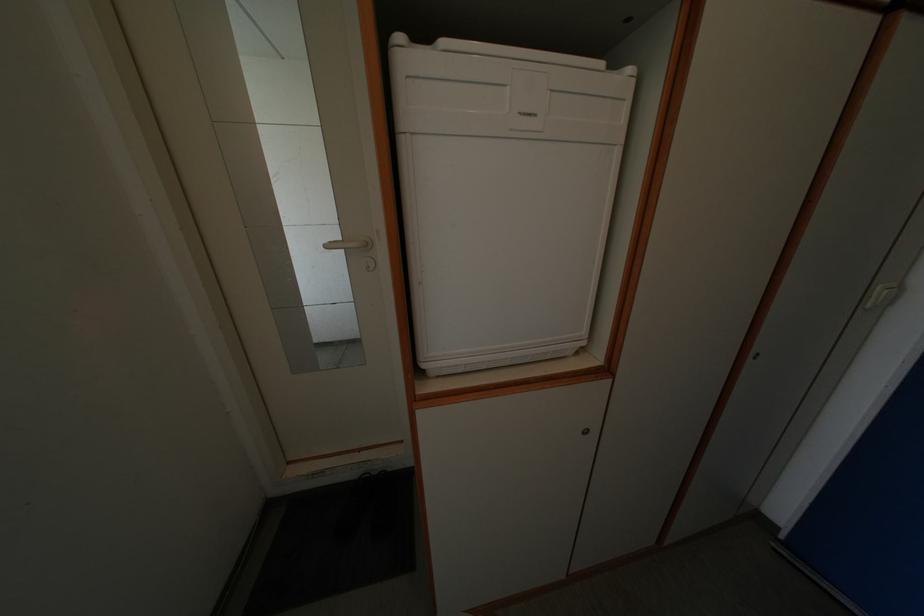
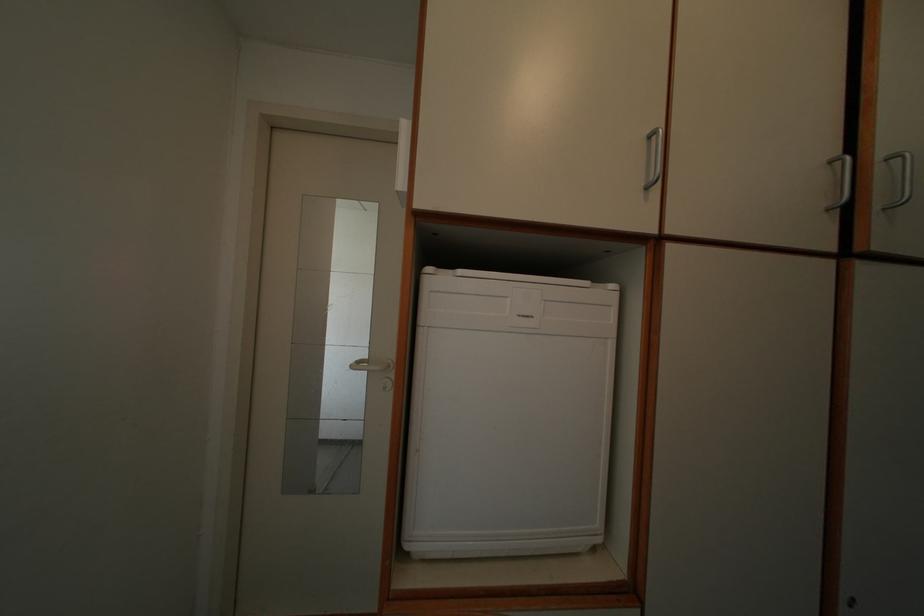
Question: The images are taken continuously from a first-person perspective. In which direction is your viewpoint rotating?

Choices:
 (A) Left
 (B) Right
 (C) Up
 (D) Down

Answer: (C)